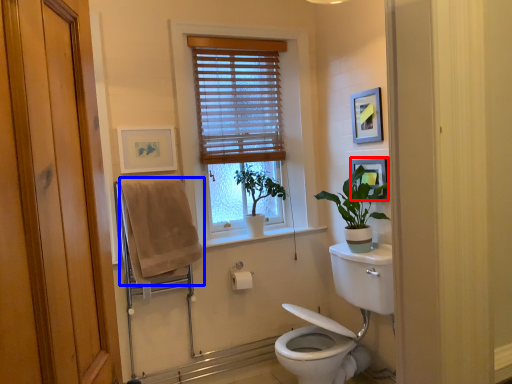
Question: Which point is closer to the camera, picture frame (highlighted by a red box) or bath towel (highlighted by a blue box)?

Choices:
 (A) picture frame
 (B) bath towel

Answer: (B)